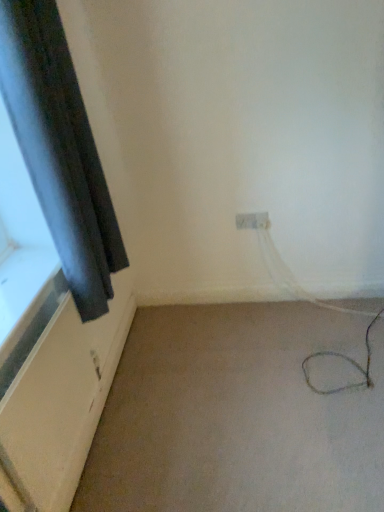
Where is `vacant region below black matte curtain at left (from a real-world perspective)`? This screenshot has height=512, width=384. vacant region below black matte curtain at left (from a real-world perspective) is located at coordinates (121, 379).